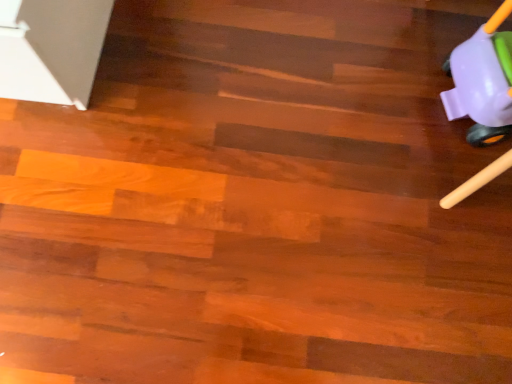
Question: Should I look upward or downward to see purple plastic toy at upper right?

Choices:
 (A) down
 (B) up

Answer: (B)